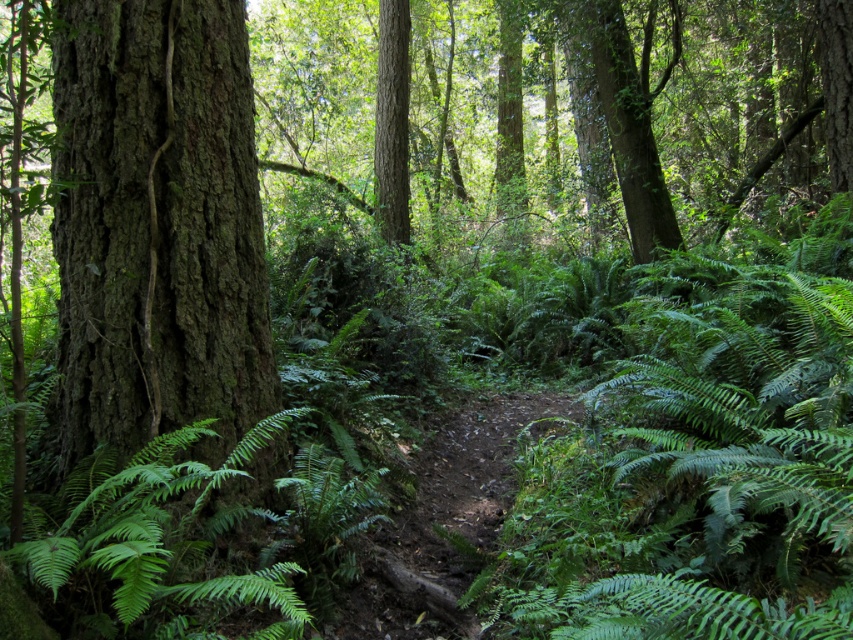
Question: Does green rough bark tree at left have a greater width compared to smooth bark tree at center?

Choices:
 (A) yes
 (B) no

Answer: (A)

Question: Can you confirm if green rough bark tree at left is thinner than smooth bark tree at center?

Choices:
 (A) no
 (B) yes

Answer: (A)

Question: Which point is closer to the camera?

Choices:
 (A) green rough bark tree at left
 (B) smooth bark tree at center

Answer: (A)

Question: Which object appears closest to the camera in this image?

Choices:
 (A) smooth bark tree at center
 (B) green rough bark tree at left

Answer: (B)

Question: Can you confirm if green rough bark tree at left is bigger than smooth bark tree at center?

Choices:
 (A) yes
 (B) no

Answer: (B)